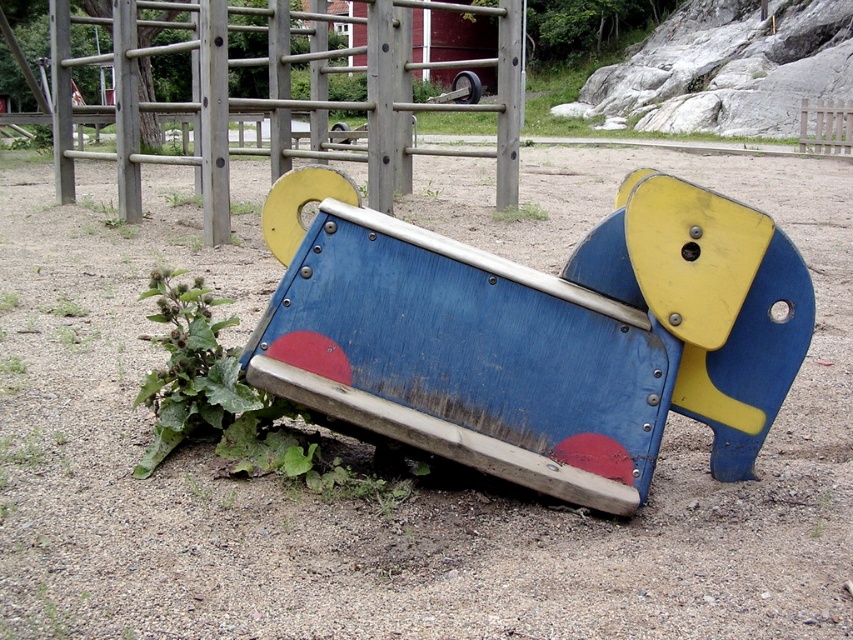
Between point (630, 212) and point (413, 470), which one is positioned in front?

Point (630, 212) is more forward.

Does matte blue wood slide at center have a lesser width compared to green leafy plant at lower left?

No.

Is point (798, 333) positioned after point (244, 429)?

No, it is not.

The height and width of the screenshot is (640, 853). Identify the location of matte blue wood slide at center. (537, 333).